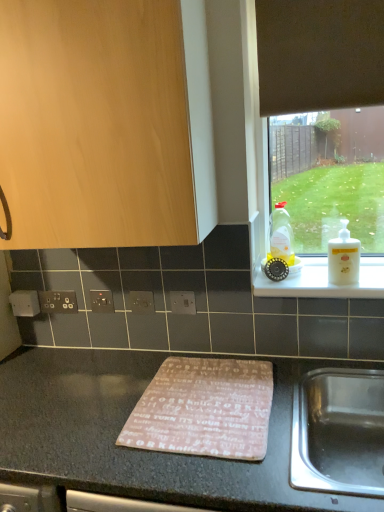
The image size is (384, 512). Find the location of `free space above pink fabric mat at center (from a real-world perspective)`. free space above pink fabric mat at center (from a real-world perspective) is located at coordinates (203, 395).